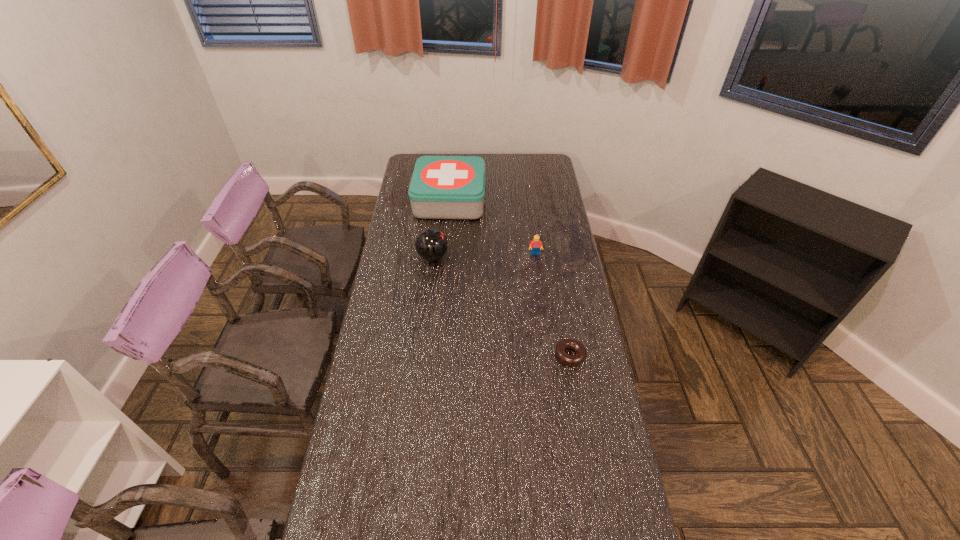
At what (x,y) coordinates should I click in order to perform the action: click on the third closest object to the sunglasses. Please return your answer as a coordinate pair (x, y). Looking at the image, I should click on (535, 244).

Identify which object is located as the fourth nearest to the third shortest object. Please provide its 2D coordinates. Your answer should be formatted as a tuple, i.e. [(x, y)], where the tuple contains the x and y coordinates of a point satisfying the conditions above.

[(383, 525)]

Locate an element on the screen. free spot that satisfies the following two spatial constraints: 1. on the face of the third tallest object; 2. on the surface of the bowling ball near the finger holes is located at coordinates (536, 257).

Find the location of a particular element. The image size is (960, 540). free space that satisfies the following two spatial constraints: 1. on the face of the third tallest object; 2. on the surface of the bowling ball near the finger holes is located at coordinates (536, 257).

Where is `vacant space that satisfies the following two spatial constraints: 1. on the surface of the doughnut near the finger holes; 2. on the right side of the bowling ball`? This screenshot has width=960, height=540. vacant space that satisfies the following two spatial constraints: 1. on the surface of the doughnut near the finger holes; 2. on the right side of the bowling ball is located at coordinates (421, 355).

At what (x,y) coordinates should I click in order to perform the action: click on free point that satisfies the following two spatial constraints: 1. on the surface of the doughnut near the finger holes; 2. on the right side of the bowling ball. Please return your answer as a coordinate pair (x, y). This screenshot has width=960, height=540. Looking at the image, I should click on (421, 355).

Locate an element on the screen. The image size is (960, 540). vacant area that satisfies the following two spatial constraints: 1. on the surface of the second nearest object near the finger holes; 2. on the left side of the bowling ball is located at coordinates (421, 355).

Find the location of a particular element. vacant point that satisfies the following two spatial constraints: 1. on the face of the Lego; 2. on the surface of the bowling ball near the finger holes is located at coordinates (536, 257).